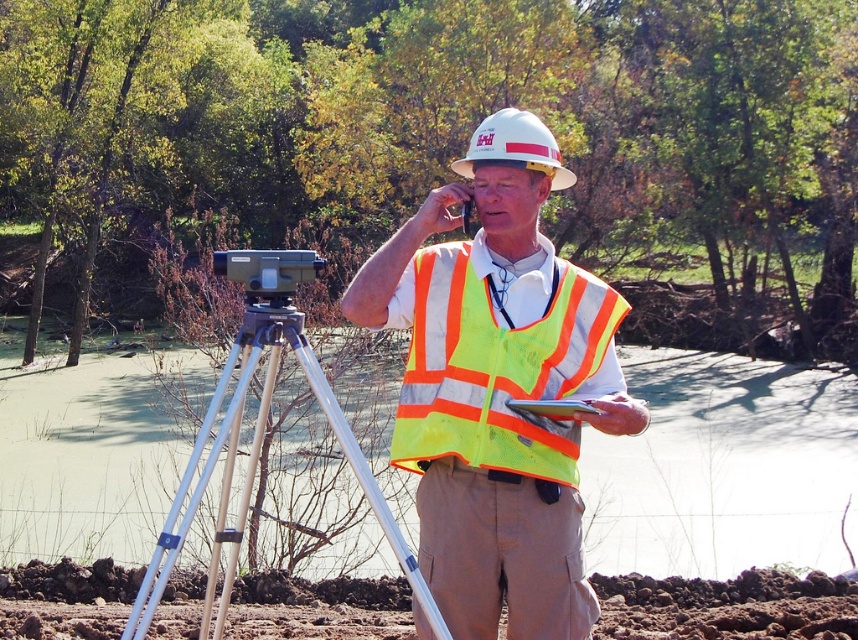
How much distance is there between dirt field at lower center and high-visibility reflective safety vest at center?

dirt field at lower center and high-visibility reflective safety vest at center are 4.25 meters apart from each other.

Between dirt field at lower center and high-visibility reflective safety vest at center, which one appears on the right side from the viewer's perspective?

From the viewer's perspective, high-visibility reflective safety vest at center appears more on the right side.

At what (x,y) coordinates should I click in order to perform the action: click on dirt field at lower center. Please return your answer as a coordinate pair (x, y). Looking at the image, I should click on (727, 605).

The height and width of the screenshot is (640, 858). Find the location of `dirt field at lower center`. dirt field at lower center is located at coordinates (727, 605).

Can you confirm if khaki cotton pants at center is bigger than silver metallic tripod at center?

No, khaki cotton pants at center is not bigger than silver metallic tripod at center.

Where is `khaki cotton pants at center`? This screenshot has width=858, height=640. khaki cotton pants at center is located at coordinates (502, 554).

In the scene shown: How distant is dirt field at lower center from white hard hat at center?

dirt field at lower center and white hard hat at center are 4.17 meters apart.

How much distance is there between dirt field at lower center and white hard hat at center?

dirt field at lower center and white hard hat at center are 4.17 meters apart.

Locate an element on the screen. This screenshot has width=858, height=640. dirt field at lower center is located at coordinates (727, 605).